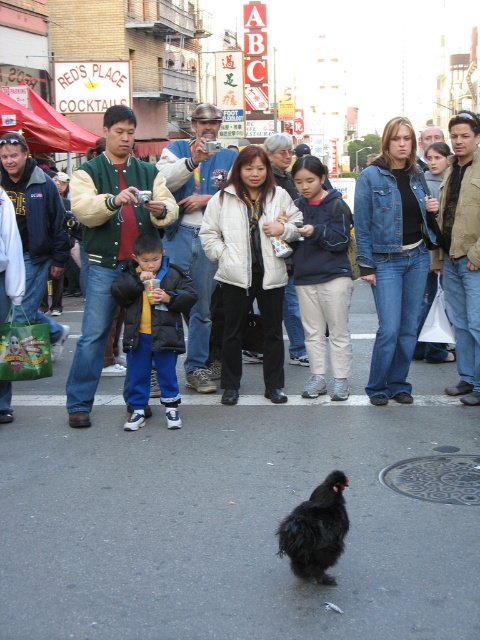
Is matte black chicken at center smaller than dark blue jacket at center?

No, matte black chicken at center is not smaller than dark blue jacket at center.

Can you confirm if matte black chicken at center is positioned below dark blue jacket at center?

No, matte black chicken at center is not below dark blue jacket at center.

Find the location of `matte black chicken at center`. matte black chicken at center is located at coordinates (264, 333).

What do you see at coordinates (152, 326) in the screenshot? Image resolution: width=480 pixels, height=640 pixels. I see `dark blue jacket at center` at bounding box center [152, 326].

Is dark blue jacket at center bigger than black fluffy chicken at center?

Yes, dark blue jacket at center is bigger than black fluffy chicken at center.

Who is more distant from viewer, [137,259] or [295,515]?

The point [137,259] is behind.

Locate an element on the screen. The width and height of the screenshot is (480, 640). dark blue jacket at center is located at coordinates (152, 326).

From the picture: Between matte black chicken at center and black fluffy chicken at center, which one has more height?

Standing taller between the two is matte black chicken at center.

Who is positioned more to the left, matte black chicken at center or black fluffy chicken at center?

matte black chicken at center is more to the left.

The height and width of the screenshot is (640, 480). Describe the element at coordinates (264, 333) in the screenshot. I see `matte black chicken at center` at that location.

You are a GUI agent. You are given a task and a screenshot of the screen. Output one action in this format:
    pyautogui.click(x=<x>, y=<y>)
    Task: Click on the matte black chicken at center
    The height and width of the screenshot is (640, 480).
    Given the screenshot: What is the action you would take?
    pyautogui.click(x=264, y=333)